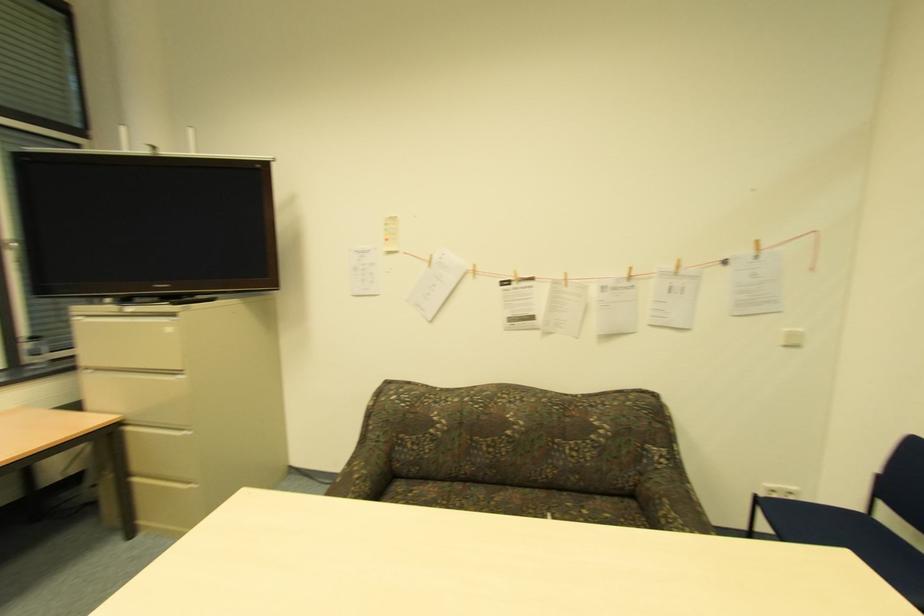
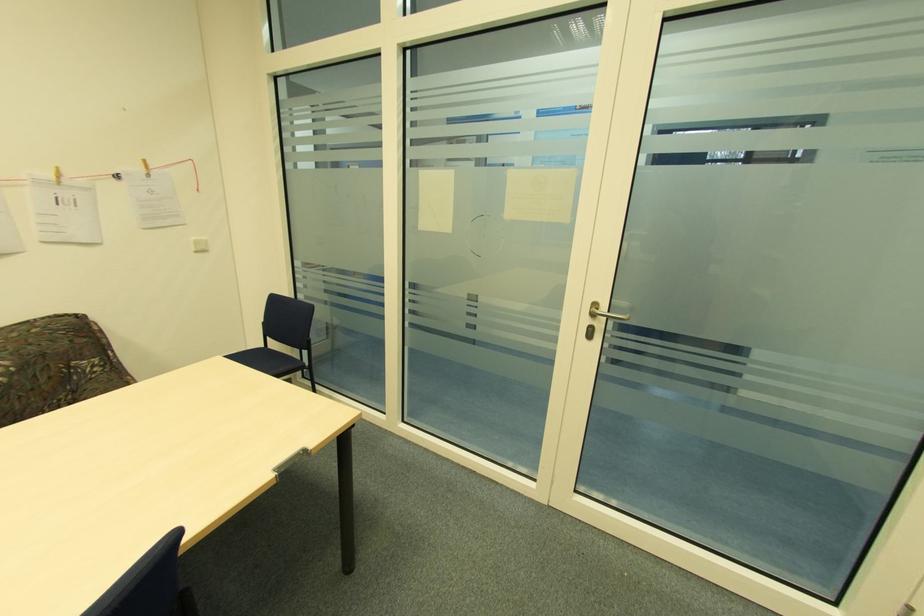
Question: The camera is either moving clockwise (left) or counter-clockwise (right) around the object. The first image is from the beginning of the video and the second image is from the end. Is the camera moving left or right when shooting the video?

Choices:
 (A) Left
 (B) Right

Answer: (A)